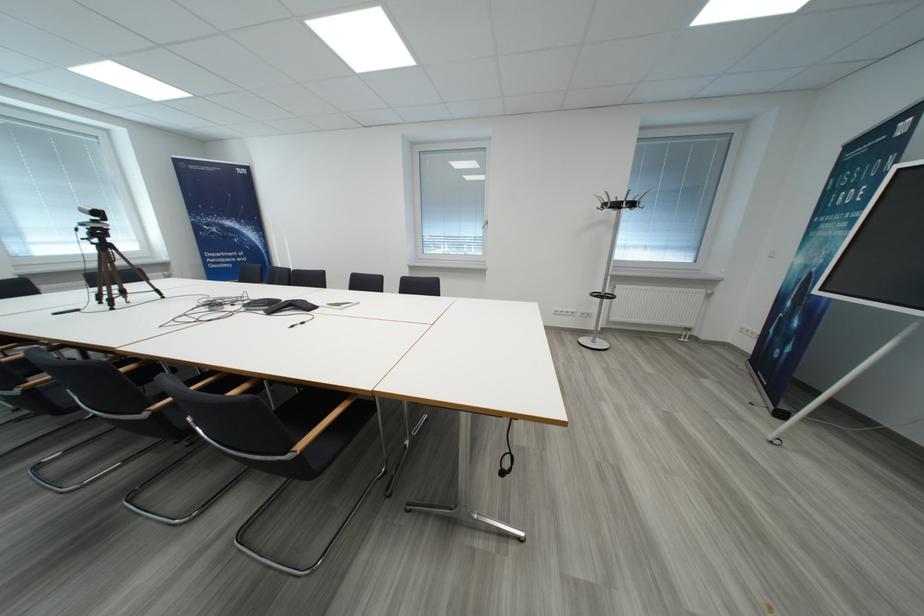
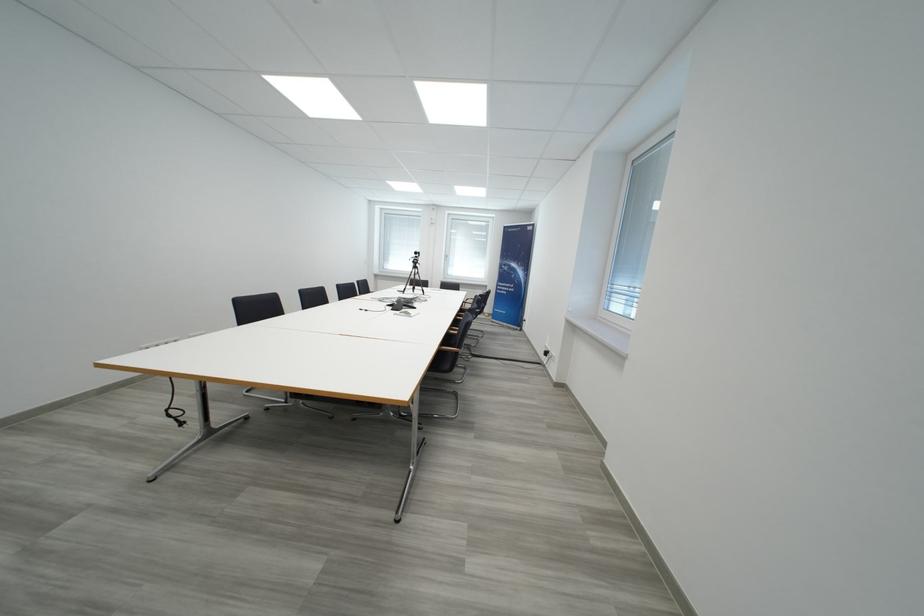
Locate, in the second image, the point that corresponds to pixel 130 294 in the first image.

(420, 291)